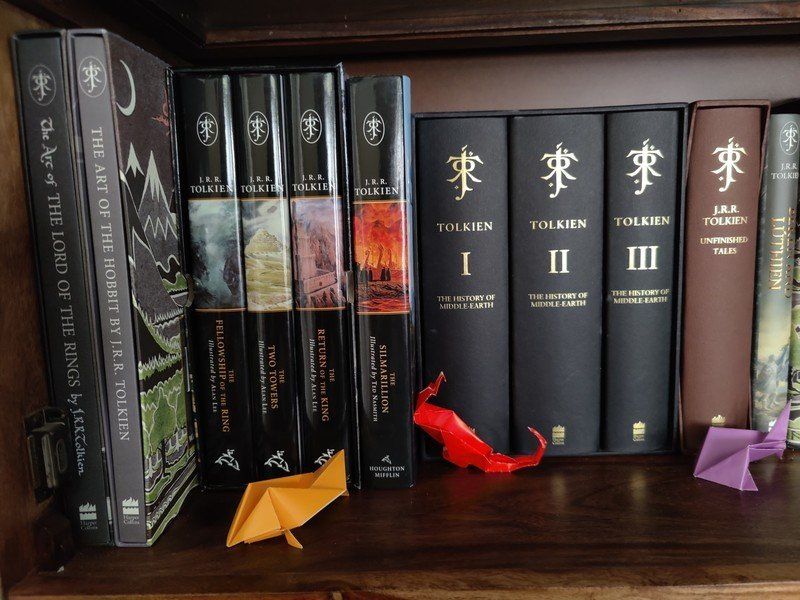
Where is `the back wall`? This screenshot has width=800, height=600. the back wall is located at coordinates (460, 77), (686, 71).